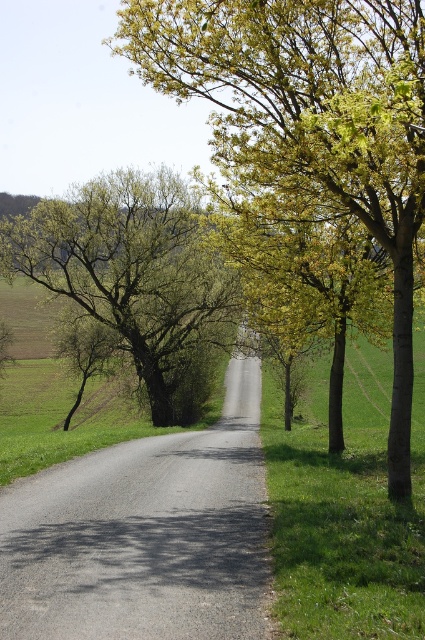
Question: Can you confirm if green leafy tree at center is positioned above green leafy tree at left?

Choices:
 (A) yes
 (B) no

Answer: (A)

Question: Which point is farther to the camera?

Choices:
 (A) (178, 314)
 (B) (413, 38)

Answer: (A)

Question: Is green leafy tree at center wider than green leafy tree at left?

Choices:
 (A) yes
 (B) no

Answer: (B)

Question: Which point is farther to the camera?

Choices:
 (A) (255, 38)
 (B) (142, 326)

Answer: (B)

Question: Can you confirm if green leafy tree at center is wider than green leafy tree at left?

Choices:
 (A) yes
 (B) no

Answer: (B)

Question: Which object is closer to the camera taking this photo?

Choices:
 (A) green leafy tree at center
 (B) green leafy tree at left

Answer: (A)